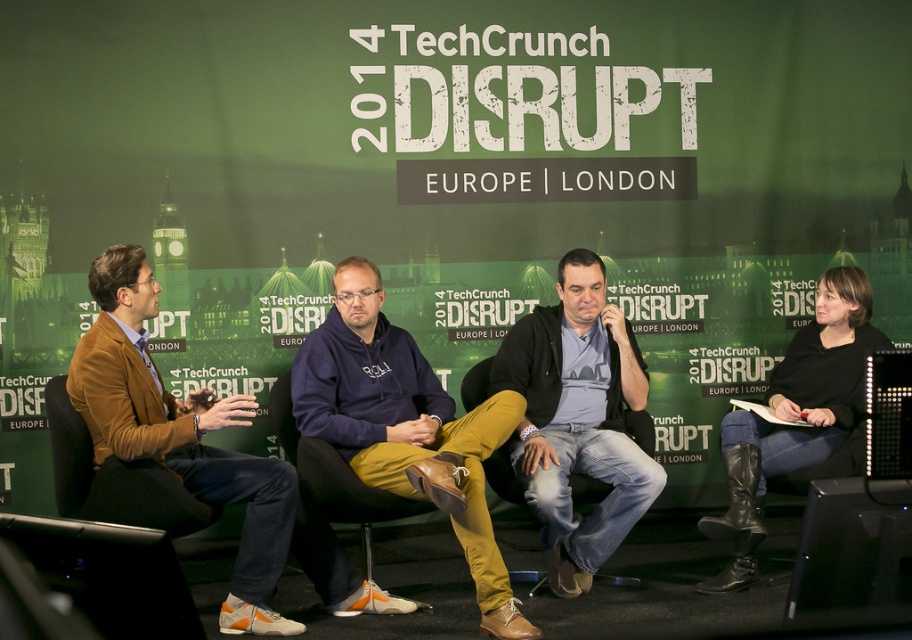
Consider the image. Where is the dark blue hoodie at center located in the image?

The dark blue hoodie at center is located at point 0.669 on the x axis and 0.446 on the y axis.

You are an event organizer at the TechCrunch Disrupt Europe event. You need to decide which of the two items, the dark blue hoodie at center or the brown leather jacket at left, requires more storage space for packing. Which one should you allocate more space for?

The dark blue hoodie at center is bigger than the brown leather jacket at left, so you should allocate more storage space for the dark blue hoodie at center.